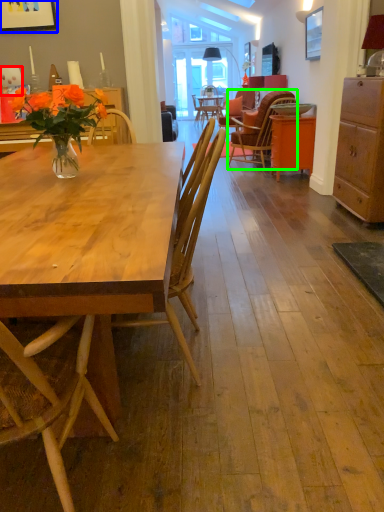
Question: Which is nearer to the coffee cup (highlighted by a red box)? picture frame (highlighted by a blue box) or chair (highlighted by a green box).

Choices:
 (A) picture frame
 (B) chair

Answer: (A)